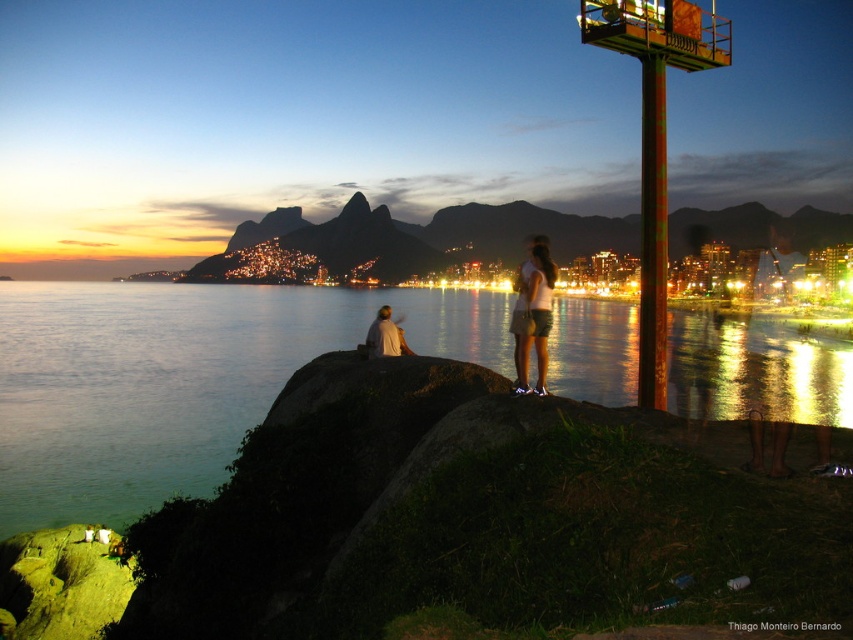
Question: Does blue water at center have a greater width compared to white matte shorts at center?

Choices:
 (A) yes
 (B) no

Answer: (A)

Question: Which point appears closest to the camera in this image?

Choices:
 (A) (505, 323)
 (B) (541, 298)

Answer: (B)

Question: Among these points, which one is nearest to the camera?

Choices:
 (A) (544, 266)
 (B) (405, 292)
 (C) (398, 321)

Answer: (A)

Question: From the image, what is the correct spatial relationship of blue water at center in relation to white fabric shirt at center?

Choices:
 (A) left
 (B) right

Answer: (A)

Question: Observing the image, what is the correct spatial positioning of white matte shorts at center in reference to white fabric shirt at center?

Choices:
 (A) left
 (B) right

Answer: (B)

Question: Which of the following is the farthest from the observer?

Choices:
 (A) white matte shorts at center
 (B) blue water at center

Answer: (A)